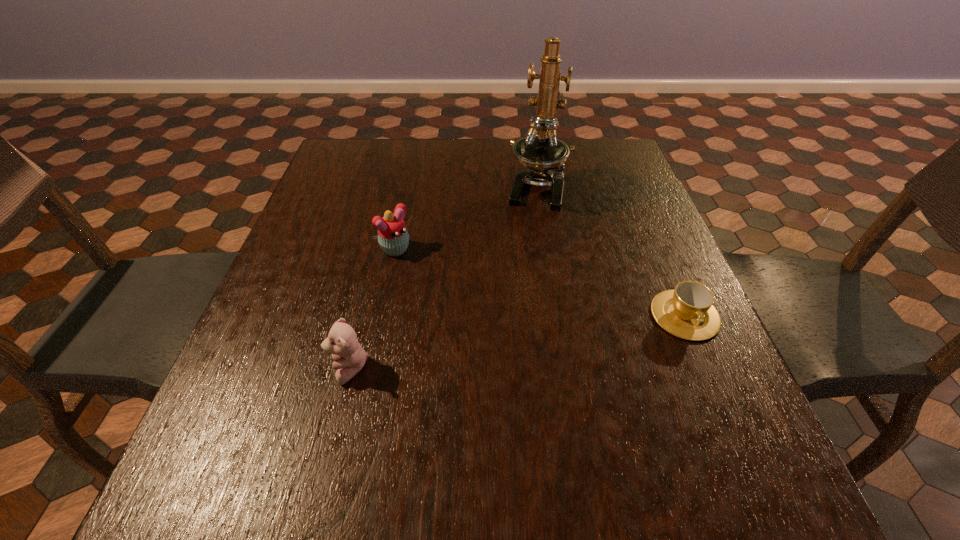
The image size is (960, 540). Identify the location of the nearest object. (341, 343).

Where is `the second nearest object`? the second nearest object is located at coordinates (687, 311).

Find the location of a particular element. the rightmost object is located at coordinates (687, 311).

Image resolution: width=960 pixels, height=540 pixels. What are the coordinates of `the third object from left to right` in the screenshot? It's located at (540, 151).

This screenshot has width=960, height=540. In order to click on the tallest object in this screenshot , I will do `click(540, 151)`.

Image resolution: width=960 pixels, height=540 pixels. In order to click on the second farthest object in this screenshot , I will do `click(393, 238)`.

Identify the location of vacant space located 0.170m at the face of the teddy bear. (237, 369).

Identify the location of vacant position located 0.180m at the face of the teddy bear. The height and width of the screenshot is (540, 960). (231, 369).

This screenshot has height=540, width=960. What are the coordinates of `vacant space located 0.120m at the face of the teddy bear` in the screenshot? It's located at (264, 369).

At what (x,y) coordinates should I click in order to perform the action: click on free space located with the handle on the side of the shortest object. Please return your answer as a coordinate pair (x, y). Looking at the image, I should click on (708, 369).